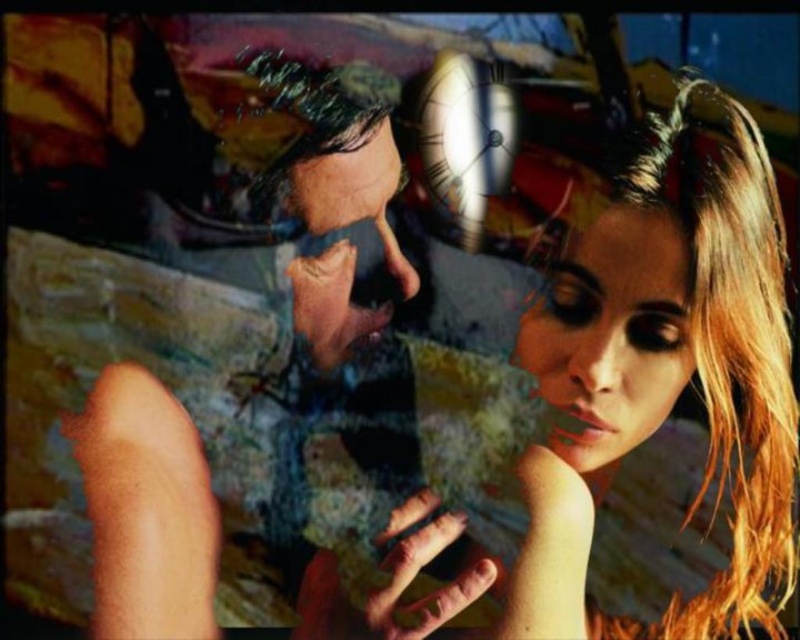
Question: In this image, where is smooth skin face at center located relative to smooth skin face at upper center?

Choices:
 (A) right
 (B) left

Answer: (A)

Question: Which point is closer to the camera?

Choices:
 (A) smooth skin face at center
 (B) smooth skin face at upper center

Answer: (A)

Question: Where is smooth skin face at center located in relation to smooth skin face at upper center in the image?

Choices:
 (A) right
 (B) left

Answer: (A)

Question: Which point appears closest to the camera in this image?

Choices:
 (A) [385, 310]
 (B) [640, 365]

Answer: (B)

Question: Is smooth skin face at center further to the viewer compared to smooth skin face at upper center?

Choices:
 (A) no
 (B) yes

Answer: (A)